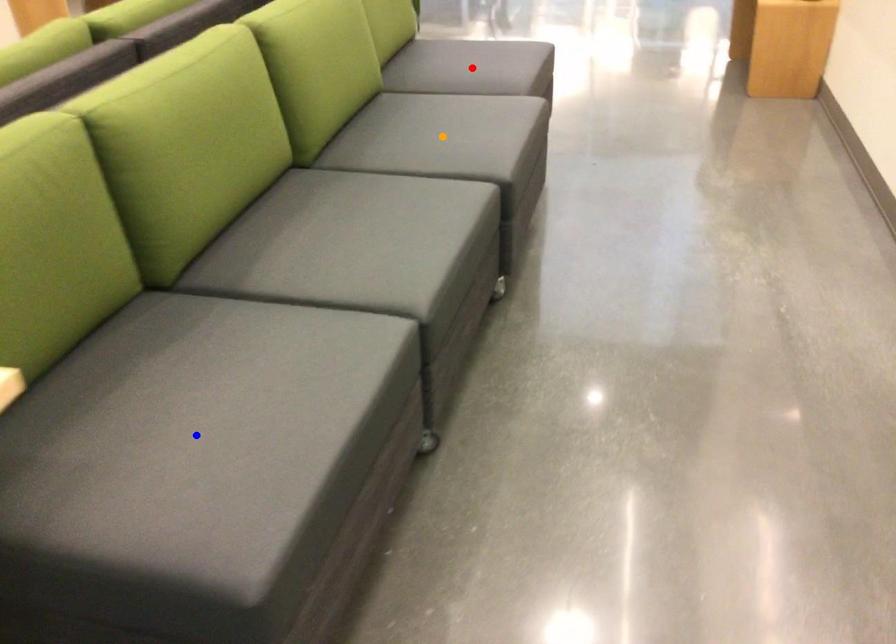
Order these from nearest to farthest:
red point | orange point | blue point

blue point → orange point → red point